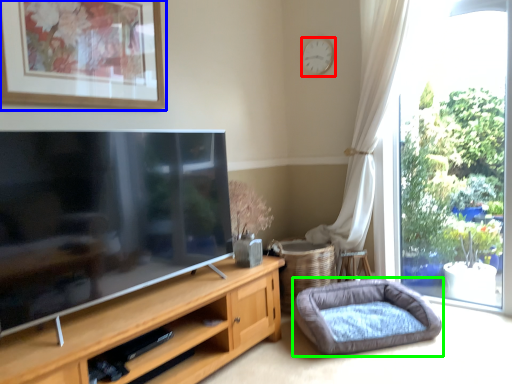
Question: Estimate the real-world distances between objects in this image. Which object is farther from clock (highlighted by a red box), picture frame (highlighted by a blue box) or dog bed (highlighted by a green box)?

Choices:
 (A) picture frame
 (B) dog bed

Answer: (B)